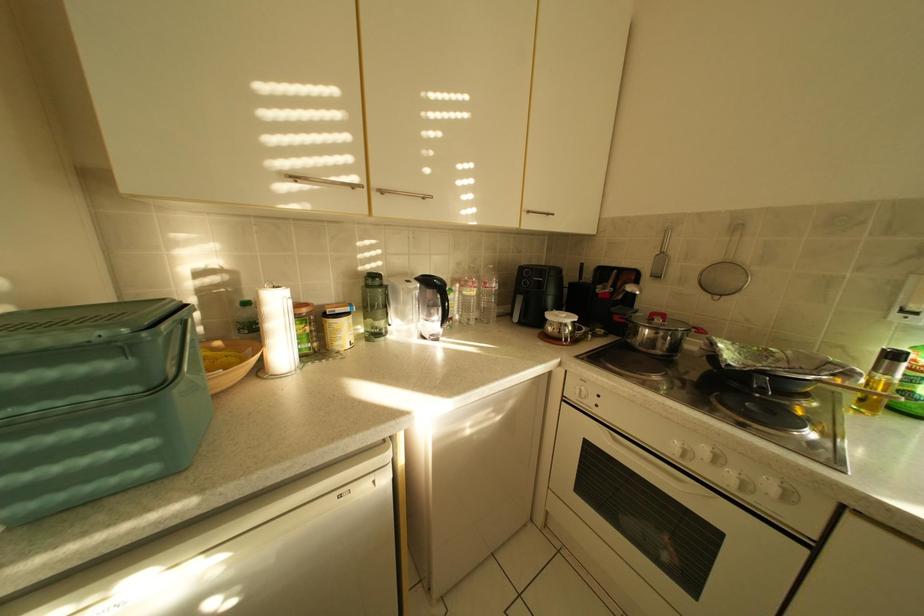
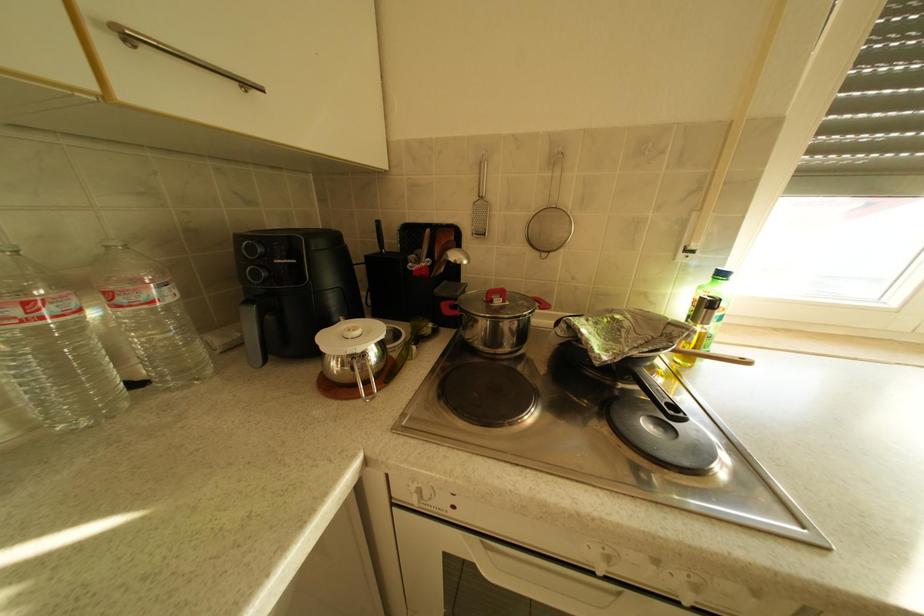
Question: The first image is from the beginning of the video and the second image is from the end. How did the camera likely rotate when shooting the video?

Choices:
 (A) Left
 (B) Right
 (C) Up
 (D) Down

Answer: (B)